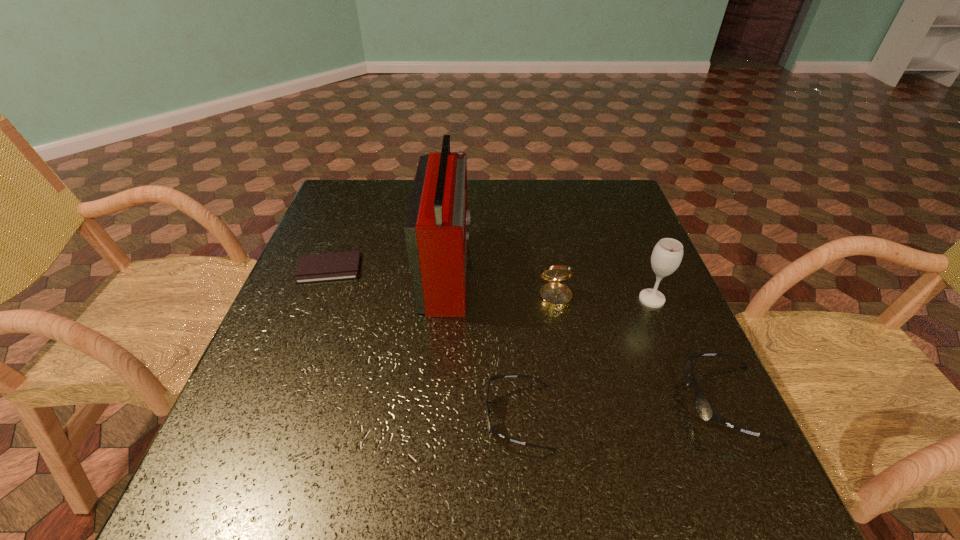
Where is `the left sunglasses`? the left sunglasses is located at coordinates (489, 426).

The height and width of the screenshot is (540, 960). I want to click on the second shortest object, so click(489, 426).

Image resolution: width=960 pixels, height=540 pixels. Identify the location of the taller sunglasses. (704, 409).

Locate an element on the screen. the right sunglasses is located at coordinates (704, 409).

You are a GUI agent. You are given a task and a screenshot of the screen. Output one action in this format:
    pyautogui.click(x=<x>, y=<y>)
    Task: Click on the radio receiver
    The height and width of the screenshot is (540, 960).
    Given the screenshot: What is the action you would take?
    [436, 229]

Find the location of a particular element. the fifth object from right to left is located at coordinates (436, 229).

Identify the location of the fifth shortest object. (667, 254).

Where is `checkbook`? This screenshot has width=960, height=540. checkbook is located at coordinates (334, 266).

Where is `the shortest object`? Image resolution: width=960 pixels, height=540 pixels. the shortest object is located at coordinates pos(334,266).

You are a GUI agent. You are given a task and a screenshot of the screen. Output one action in this format:
    pyautogui.click(x=<x>, y=<y>)
    Task: Click on the compass
    
    Given the screenshot: What is the action you would take?
    pyautogui.click(x=554, y=295)